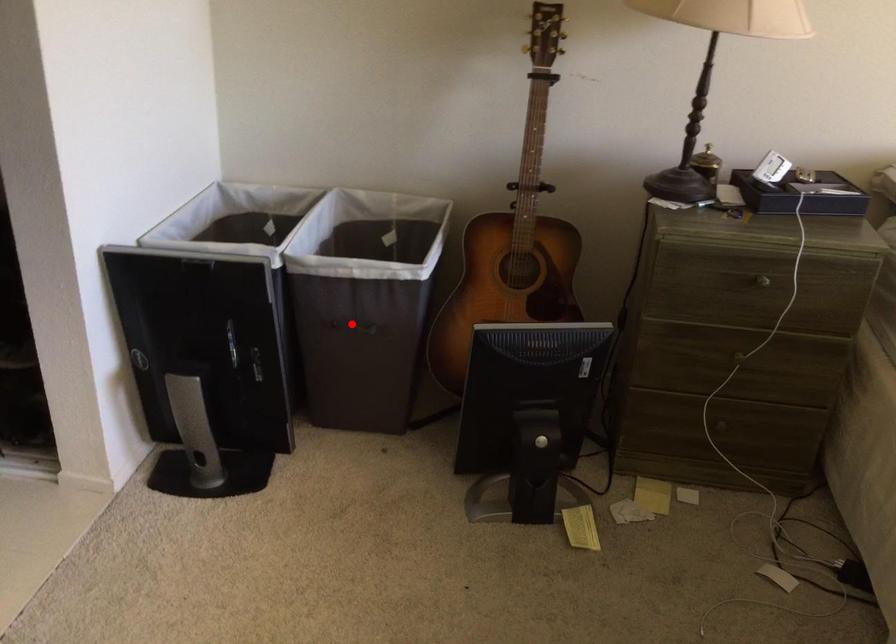
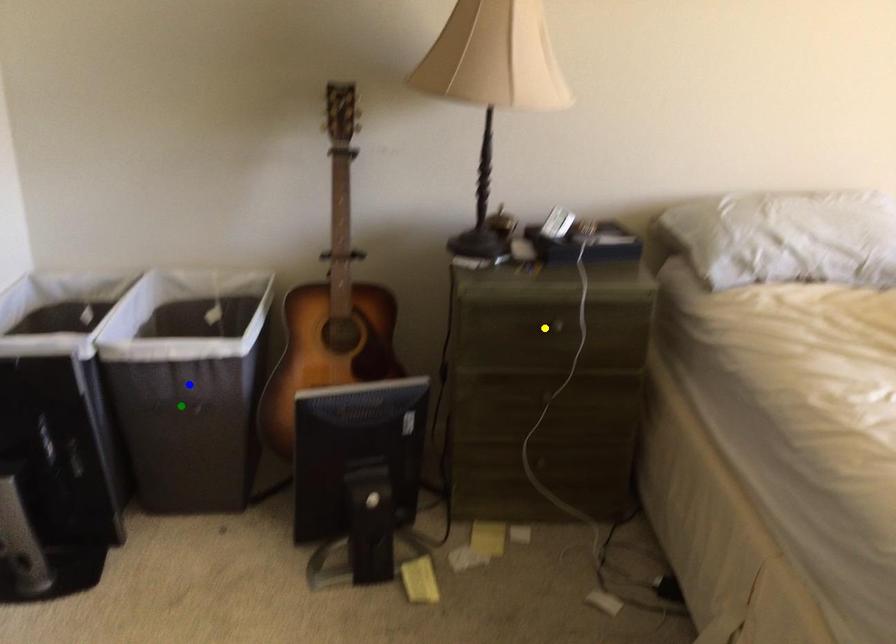
Question: I am providing you with two images of the same scene from different viewpoints. A red point is marked on the first image. You are given multiple points on the second image. Can you choose the point in image 2 that corresponds to the point in image 1?

Choices:
 (A) green point
 (B) blue point
 (C) yellow point

Answer: (A)